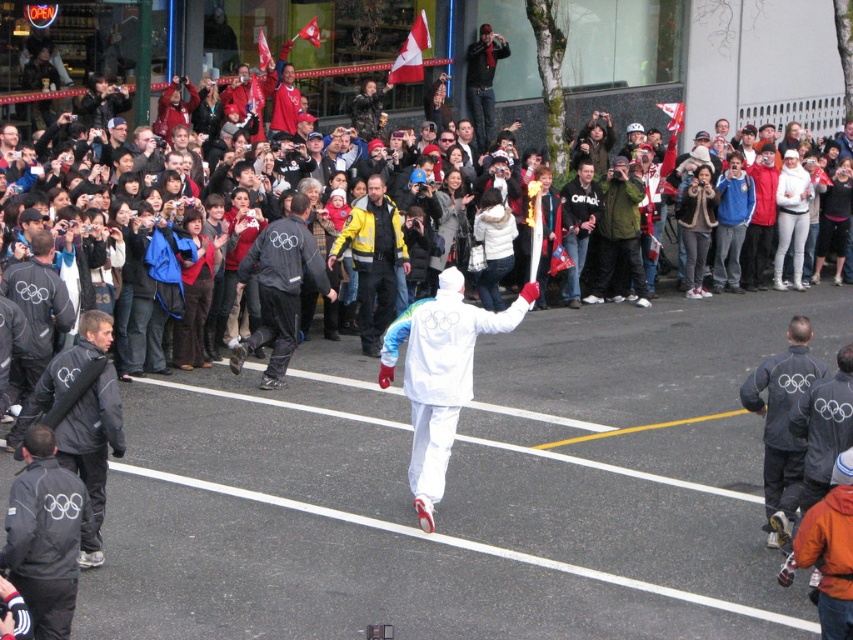
You are standing at the point labeled point (469, 332) and want to take a photo of the Olympic torch. Is the point labeled point (468, 109) between you and the torch?

Point (469, 332) is closer to the camera than point (468, 109), so the point labeled point (468, 109) is behind you and not between you and the Olympic torch.

You are a photographer standing at the edge of the street where the Olympic torch relay is passing by. You want to capture a photo of both the white matte olympic uniform at center and the dark blue jacket at upper center in the same frame. Given that your camera has a maximum focal length that allows capturing objects up to 10 meters apart, will you be able to include both subjects in your photo?

The white matte olympic uniform at center and the dark blue jacket at upper center are 12.73 meters apart, which exceeds the camera maximum focal length of 10 meters. Therefore, you cannot capture both subjects in the same frame.